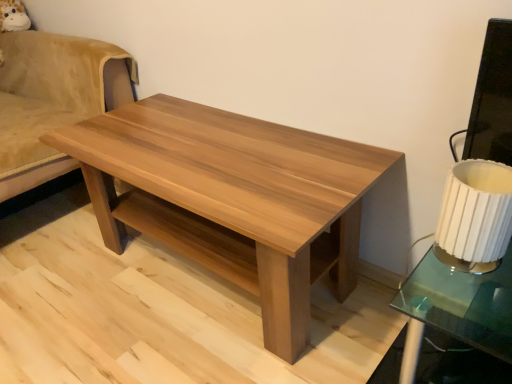
Question: From the image's perspective, does natural wood coffee table at center appear higher than white pleated fabric lampshade at right?

Choices:
 (A) yes
 (B) no

Answer: (B)

Question: Would you say natural wood coffee table at center is outside white pleated fabric lampshade at right?

Choices:
 (A) no
 (B) yes

Answer: (B)

Question: Considering the relative positions of natural wood coffee table at center and white pleated fabric lampshade at right in the image provided, is natural wood coffee table at center to the right of white pleated fabric lampshade at right from the viewer's perspective?

Choices:
 (A) yes
 (B) no

Answer: (B)

Question: From the image's perspective, is natural wood coffee table at center located beneath white pleated fabric lampshade at right?

Choices:
 (A) yes
 (B) no

Answer: (A)

Question: Is natural wood coffee table at center turned away from white pleated fabric lampshade at right?

Choices:
 (A) yes
 (B) no

Answer: (B)

Question: Is natural wood coffee table at center shorter than white pleated fabric lampshade at right?

Choices:
 (A) yes
 (B) no

Answer: (B)

Question: Is white pleated fabric lampshade at right smaller than light brown wood swivel chair at left?

Choices:
 (A) yes
 (B) no

Answer: (A)

Question: Is white pleated fabric lampshade at right turned away from light brown wood swivel chair at left?

Choices:
 (A) no
 (B) yes

Answer: (A)

Question: Is white pleated fabric lampshade at right completely or partially outside of light brown wood swivel chair at left?

Choices:
 (A) yes
 (B) no

Answer: (A)

Question: Considering the relative sizes of white pleated fabric lampshade at right and light brown wood swivel chair at left in the image provided, is white pleated fabric lampshade at right shorter than light brown wood swivel chair at left?

Choices:
 (A) no
 (B) yes

Answer: (B)

Question: Is white pleated fabric lampshade at right behind light brown wood swivel chair at left?

Choices:
 (A) yes
 (B) no

Answer: (B)

Question: Does white pleated fabric lampshade at right turn towards light brown wood swivel chair at left?

Choices:
 (A) yes
 (B) no

Answer: (B)

Question: Is light brown wood swivel chair at left beside natural wood coffee table at center?

Choices:
 (A) yes
 (B) no

Answer: (B)